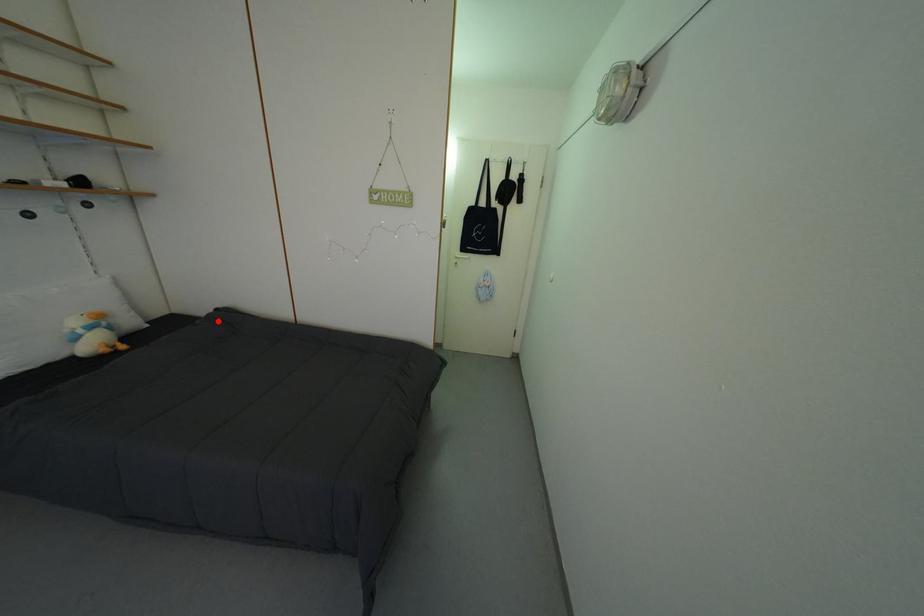
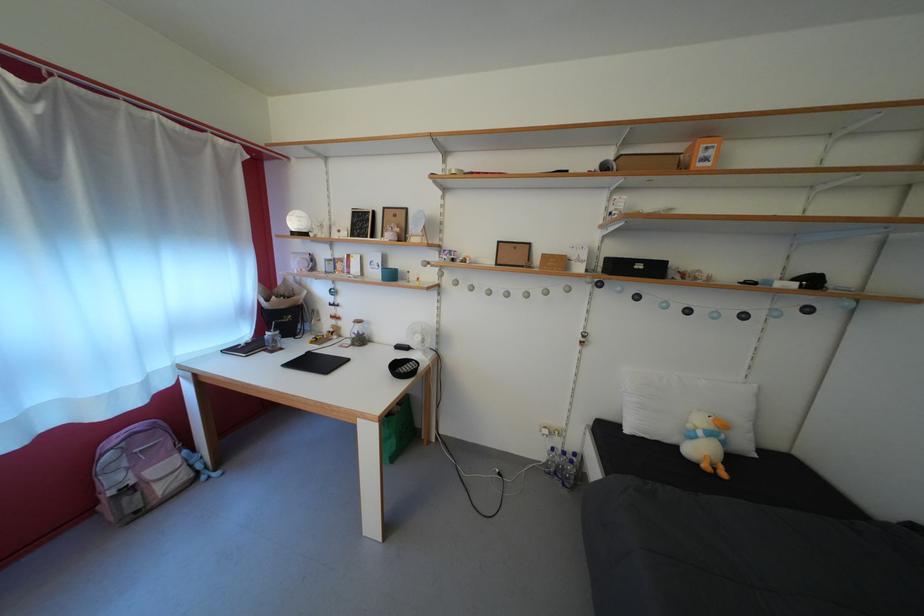
The point at the highlighted location is marked in the first image. Where is the corresponding point in the second image?

(897, 530)